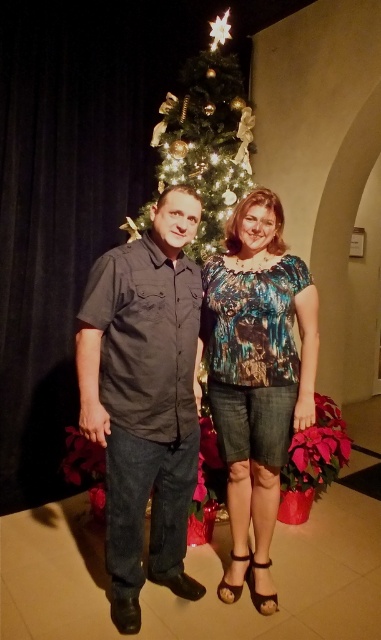
Question: Does matte black shirt at center appear on the right side of printed fabric blouse at center?

Choices:
 (A) no
 (B) yes

Answer: (A)

Question: Is printed fabric blouse at center bigger than green glittering christmas tree at center?

Choices:
 (A) no
 (B) yes

Answer: (A)

Question: Which point is farther from the camera taking this photo?

Choices:
 (A) (86, 410)
 (B) (281, 321)

Answer: (B)

Question: Is printed fabric blouse at center to the right of green glittering christmas tree at center from the viewer's perspective?

Choices:
 (A) no
 (B) yes

Answer: (B)

Question: Estimate the real-world distances between objects in this image. Which object is farther from the printed fabric blouse at center?

Choices:
 (A) green glittering christmas tree at center
 (B) matte black shirt at center

Answer: (A)

Question: Which of the following is the closest to the observer?

Choices:
 (A) printed fabric blouse at center
 (B) matte black shirt at center

Answer: (B)